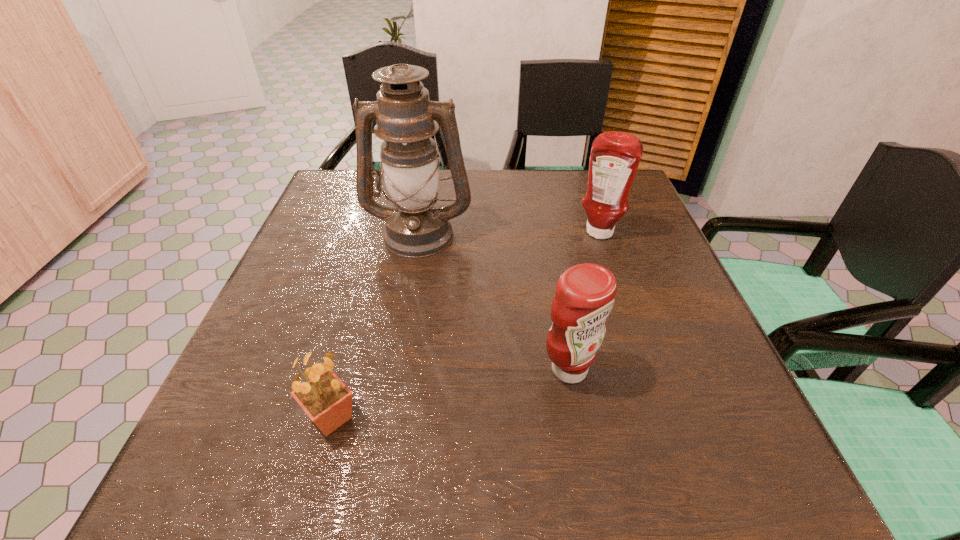
The height and width of the screenshot is (540, 960). In order to click on oil lamp in this screenshot , I will do `click(416, 226)`.

At what (x,y) coordinates should I click in order to perform the action: click on the right condiment. Please return your answer as a coordinate pair (x, y). The image size is (960, 540). Looking at the image, I should click on [x=615, y=156].

Where is `the farther condiment`? the farther condiment is located at coordinates (615, 156).

Locate an element on the screen. the shorter condiment is located at coordinates (585, 293).

The height and width of the screenshot is (540, 960). I want to click on the third farthest object, so click(x=585, y=293).

I want to click on sunflower, so click(x=327, y=401).

Identify the location of the nearest object. The width and height of the screenshot is (960, 540). (327, 401).

Locate an element on the screen. free space located 0.380m on the right of the tallest object is located at coordinates (626, 233).

Identify the location of vacant space located on the front of the right condiment. (618, 290).

Identify the location of vacant region located on the back of the third farthest object. This screenshot has width=960, height=540. (x=555, y=291).